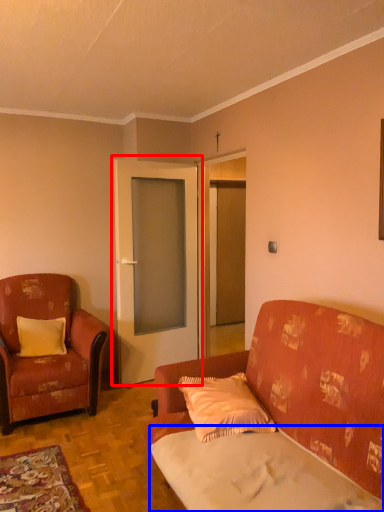
Question: Which object appears farthest to the camera in this image, door (highlighted by a red box) or sheet (highlighted by a blue box)?

Choices:
 (A) door
 (B) sheet

Answer: (A)